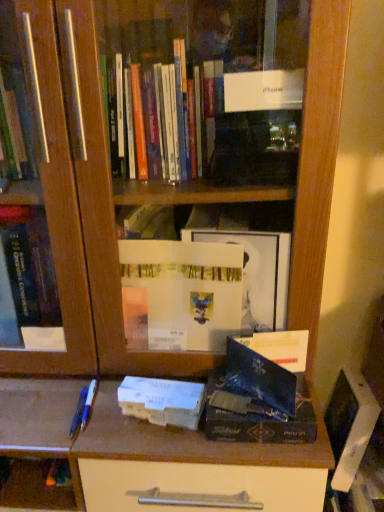
Where is `shiny black book at center, which appears as the 1th paperback book when viewed from the right`? shiny black book at center, which appears as the 1th paperback book when viewed from the right is located at coordinates (265, 379).

This screenshot has width=384, height=512. What do you see at coordinates (162, 401) in the screenshot? I see `white matte paperback book at center, which ranks as the 1th paperback book in left-to-right order` at bounding box center [162, 401].

At what (x,y) coordinates should I click in order to perform the action: click on blue plastic pen at lower left, arranged as the 1th pen when viewed from the left. Please return your answer as a coordinate pair (x, y). Looking at the image, I should click on (79, 413).

Identify the location of blue plastic pen at lower left, which ranks as the second pen in left-to-right order. Image resolution: width=384 pixels, height=512 pixels. (89, 404).

Is blue plastic pen at lower left, arranged as the 1th pen when viewed from the left, looking in the opposite direction of shiny black book at center, which appears as the 1th paperback book when viewed from the right?

No.

Between blue plastic pen at lower left, which is counted as the second pen, starting from the right, and shiny black book at center, which appears as the 1th paperback book when viewed from the right, which one has larger size?

Bigger between the two is shiny black book at center, which appears as the 1th paperback book when viewed from the right.

Could shiny black book at center, arranged as the 2th paperback book when viewed from the left, be considered to be inside blue plastic pen at lower left, arranged as the 1th pen when viewed from the left?

No.

In the scene shown: Choose the correct answer: Is shiny black book at center, which appears as the 1th paperback book when viewed from the right, inside blue plastic pen at lower left, which is the first pen in right-to-left order, or outside it?

shiny black book at center, which appears as the 1th paperback book when viewed from the right, cannot be found inside blue plastic pen at lower left, which is the first pen in right-to-left order.

Does shiny black book at center, arranged as the 2th paperback book when viewed from the left, come in front of blue plastic pen at lower left, which ranks as the second pen in left-to-right order?

Yes, it is in front of blue plastic pen at lower left, which ranks as the second pen in left-to-right order.

Can you confirm if shiny black book at center, which appears as the 1th paperback book when viewed from the right, is positioned to the left of blue plastic pen at lower left, which is the first pen in right-to-left order?

Incorrect, shiny black book at center, which appears as the 1th paperback book when viewed from the right, is not on the left side of blue plastic pen at lower left, which is the first pen in right-to-left order.

Can you tell me how much shiny black book at center, arranged as the 2th paperback book when viewed from the left, and blue plastic pen at lower left, which ranks as the second pen in left-to-right order, differ in facing direction?

The angular difference between shiny black book at center, arranged as the 2th paperback book when viewed from the left, and blue plastic pen at lower left, which ranks as the second pen in left-to-right order, is 4.4 degrees.

Can you tell me how much shiny black book at center, arranged as the 2th paperback book when viewed from the left, and white matte paperback book at center, which is counted as the 2th paperback book, starting from the right, differ in facing direction?

The angular difference between shiny black book at center, arranged as the 2th paperback book when viewed from the left, and white matte paperback book at center, which is counted as the 2th paperback book, starting from the right, is 6.86 degrees.

From a real-world perspective, does shiny black book at center, arranged as the 2th paperback book when viewed from the left, sit lower than white matte paperback book at center, which ranks as the 1th paperback book in left-to-right order?

Yes, from a real-world perspective, shiny black book at center, arranged as the 2th paperback book when viewed from the left, is under white matte paperback book at center, which ranks as the 1th paperback book in left-to-right order.

Is shiny black book at center, which appears as the 1th paperback book when viewed from the right, facing away from white matte paperback book at center, which ranks as the 1th paperback book in left-to-right order?

shiny black book at center, which appears as the 1th paperback book when viewed from the right, does not have its back to white matte paperback book at center, which ranks as the 1th paperback book in left-to-right order.

In terms of width, does shiny black book at center, which appears as the 1th paperback book when viewed from the right, look wider or thinner when compared to white matte paperback book at center, which is counted as the 2th paperback book, starting from the right?

Considering their sizes, shiny black book at center, which appears as the 1th paperback book when viewed from the right, looks broader than white matte paperback book at center, which is counted as the 2th paperback book, starting from the right.

Considering the positions of objects blue plastic pen at lower left, which is the first pen in right-to-left order, and shiny black book at center, which appears as the 1th paperback book when viewed from the right, in the image provided, who is more to the left, blue plastic pen at lower left, which is the first pen in right-to-left order, or shiny black book at center, which appears as the 1th paperback book when viewed from the right,?

blue plastic pen at lower left, which is the first pen in right-to-left order, is more to the left.

From the image's perspective, is blue plastic pen at lower left, which ranks as the second pen in left-to-right order, under shiny black book at center, arranged as the 2th paperback book when viewed from the left?

Indeed, from the image's perspective, blue plastic pen at lower left, which ranks as the second pen in left-to-right order, is shown beneath shiny black book at center, arranged as the 2th paperback book when viewed from the left.

Is blue plastic pen at lower left, which ranks as the second pen in left-to-right order, oriented towards shiny black book at center, which appears as the 1th paperback book when viewed from the right?

No.

In the scene shown: Can you confirm if blue plastic pen at lower left, which is the first pen in right-to-left order, is shorter than shiny black book at center, which appears as the 1th paperback book when viewed from the right?

Yes.

How far apart are blue plastic pen at lower left, arranged as the 1th pen when viewed from the left, and blue plastic pen at lower left, which is the first pen in right-to-left order?

A distance of 0.49 inches exists between blue plastic pen at lower left, arranged as the 1th pen when viewed from the left, and blue plastic pen at lower left, which is the first pen in right-to-left order.

Is blue plastic pen at lower left, arranged as the 1th pen when viewed from the left, facing away from blue plastic pen at lower left, which ranks as the second pen in left-to-right order?

No, blue plastic pen at lower left, which ranks as the second pen in left-to-right order, is not at the back of blue plastic pen at lower left, arranged as the 1th pen when viewed from the left.

Considering the relative sizes of blue plastic pen at lower left, which is counted as the second pen, starting from the right, and blue plastic pen at lower left, which ranks as the second pen in left-to-right order, in the image provided, is blue plastic pen at lower left, which is counted as the second pen, starting from the right, bigger than blue plastic pen at lower left, which ranks as the second pen in left-to-right order,?

Indeed, blue plastic pen at lower left, which is counted as the second pen, starting from the right, has a larger size compared to blue plastic pen at lower left, which ranks as the second pen in left-to-right order.

From a real-world perspective, is shiny black book at center, which appears as the 1th paperback book when viewed from the right, positioned above or below blue plastic pen at lower left, which is counted as the second pen, starting from the right?

From a real-world perspective, shiny black book at center, which appears as the 1th paperback book when viewed from the right, is physically above blue plastic pen at lower left, which is counted as the second pen, starting from the right.

Is shiny black book at center, which appears as the 1th paperback book when viewed from the right, at the right side of blue plastic pen at lower left, which is counted as the second pen, starting from the right?

Yes.

Would you consider shiny black book at center, arranged as the 2th paperback book when viewed from the left, to be distant from blue plastic pen at lower left, which is counted as the second pen, starting from the right?

Actually, shiny black book at center, arranged as the 2th paperback book when viewed from the left, and blue plastic pen at lower left, which is counted as the second pen, starting from the right, are a little close together.

Find the location of `the 2nd pen to the left when counting from the shiny black book at center, arranged as the 2th paperback book when viewed from the left`. the 2nd pen to the left when counting from the shiny black book at center, arranged as the 2th paperback book when viewed from the left is located at coordinates (79, 413).

Where is `the 1st pen counting from the left side of the white matte paperback book at center, which ranks as the 1th paperback book in left-to-right order`? This screenshot has width=384, height=512. the 1st pen counting from the left side of the white matte paperback book at center, which ranks as the 1th paperback book in left-to-right order is located at coordinates (89, 404).

Choose the correct answer: Is white matte paperback book at center, which ranks as the 1th paperback book in left-to-right order, inside blue plastic pen at lower left, which ranks as the second pen in left-to-right order, or outside it?

white matte paperback book at center, which ranks as the 1th paperback book in left-to-right order, is not inside blue plastic pen at lower left, which ranks as the second pen in left-to-right order, it's outside.

From a real-world perspective, which is physically above, white matte paperback book at center, which ranks as the 1th paperback book in left-to-right order, or blue plastic pen at lower left, which is the first pen in right-to-left order?

From a 3D spatial view, white matte paperback book at center, which ranks as the 1th paperback book in left-to-right order, is above.

How different are the orientations of white matte paperback book at center, which is counted as the 2th paperback book, starting from the right, and blue plastic pen at lower left, which is the first pen in right-to-left order, in degrees?

The angle between the facing direction of white matte paperback book at center, which is counted as the 2th paperback book, starting from the right, and the facing direction of blue plastic pen at lower left, which is the first pen in right-to-left order, is 11.3 degrees.

There is a blue plastic pen at lower left, which is counted as the second pen, starting from the right. What are the coordinates of `the 1st paperback book above it (from a real-world perspective)` in the screenshot? It's located at (265, 379).

This screenshot has width=384, height=512. What are the coordinates of `the 1st pen below the shiny black book at center, arranged as the 2th paperback book when viewed from the left (from the image's perspective)` in the screenshot? It's located at (89, 404).

Considering their positions, is blue plastic pen at lower left, which ranks as the second pen in left-to-right order, positioned further to blue plastic pen at lower left, which is counted as the second pen, starting from the right, than shiny black book at center, arranged as the 2th paperback book when viewed from the left?

The object further to blue plastic pen at lower left, which is counted as the second pen, starting from the right, is shiny black book at center, arranged as the 2th paperback book when viewed from the left.

From the image, which object appears to be nearer to blue plastic pen at lower left, arranged as the 1th pen when viewed from the left, blue plastic pen at lower left, which is the first pen in right-to-left order, or white matte paperback book at center, which ranks as the 1th paperback book in left-to-right order?

Among the two, blue plastic pen at lower left, which is the first pen in right-to-left order, is located nearer to blue plastic pen at lower left, arranged as the 1th pen when viewed from the left.

Considering their positions, is blue plastic pen at lower left, which is the first pen in right-to-left order, positioned further to white matte paperback book at center, which ranks as the 1th paperback book in left-to-right order, than blue plastic pen at lower left, which is counted as the second pen, starting from the right?

blue plastic pen at lower left, which is counted as the second pen, starting from the right, is further to white matte paperback book at center, which ranks as the 1th paperback book in left-to-right order.

Estimate the real-world distances between objects in this image. Which object is further from blue plastic pen at lower left, arranged as the 1th pen when viewed from the left, shiny black book at center, arranged as the 2th paperback book when viewed from the left, or white matte paperback book at center, which ranks as the 1th paperback book in left-to-right order?

shiny black book at center, arranged as the 2th paperback book when viewed from the left, is further to blue plastic pen at lower left, arranged as the 1th pen when viewed from the left.

Estimate the real-world distances between objects in this image. Which object is further from shiny black book at center, arranged as the 2th paperback book when viewed from the left, white matte paperback book at center, which is counted as the 2th paperback book, starting from the right, or blue plastic pen at lower left, arranged as the 1th pen when viewed from the left?

Based on the image, blue plastic pen at lower left, arranged as the 1th pen when viewed from the left, appears to be further to shiny black book at center, arranged as the 2th paperback book when viewed from the left.

From the image, which object appears to be nearer to blue plastic pen at lower left, which is counted as the second pen, starting from the right, white matte paperback book at center, which ranks as the 1th paperback book in left-to-right order, or shiny black book at center, arranged as the 2th paperback book when viewed from the left?

Result: white matte paperback book at center, which ranks as the 1th paperback book in left-to-right order, is positioned closer to the anchor blue plastic pen at lower left, which is counted as the second pen, starting from the right.

Which object lies nearer to the anchor point white matte paperback book at center, which is counted as the 2th paperback book, starting from the right, shiny black book at center, arranged as the 2th paperback book when viewed from the left, or blue plastic pen at lower left, which is the first pen in right-to-left order?

shiny black book at center, arranged as the 2th paperback book when viewed from the left, is closer to white matte paperback book at center, which is counted as the 2th paperback book, starting from the right.

Based on their spatial positions, is blue plastic pen at lower left, which is counted as the second pen, starting from the right, or white matte paperback book at center, which ranks as the 1th paperback book in left-to-right order, closer to blue plastic pen at lower left, which ranks as the second pen in left-to-right order?

Based on the image, blue plastic pen at lower left, which is counted as the second pen, starting from the right, appears to be nearer to blue plastic pen at lower left, which ranks as the second pen in left-to-right order.

Locate an element on the screen. The width and height of the screenshot is (384, 512). paperback book between blue plastic pen at lower left, which is the first pen in right-to-left order, and shiny black book at center, arranged as the 2th paperback book when viewed from the left is located at coordinates (162, 401).

The image size is (384, 512). I want to click on pen situated between blue plastic pen at lower left, arranged as the 1th pen when viewed from the left, and white matte paperback book at center, which ranks as the 1th paperback book in left-to-right order, from left to right, so click(x=89, y=404).

Find the location of `paperback book between blue plastic pen at lower left, arranged as the 1th pen when viewed from the left, and shiny black book at center, which appears as the 1th paperback book when viewed from the right, in the horizontal direction`. paperback book between blue plastic pen at lower left, arranged as the 1th pen when viewed from the left, and shiny black book at center, which appears as the 1th paperback book when viewed from the right, in the horizontal direction is located at coordinates (162, 401).

Locate an element on the screen. pen between blue plastic pen at lower left, arranged as the 1th pen when viewed from the left, and shiny black book at center, arranged as the 2th paperback book when viewed from the left is located at coordinates (89, 404).